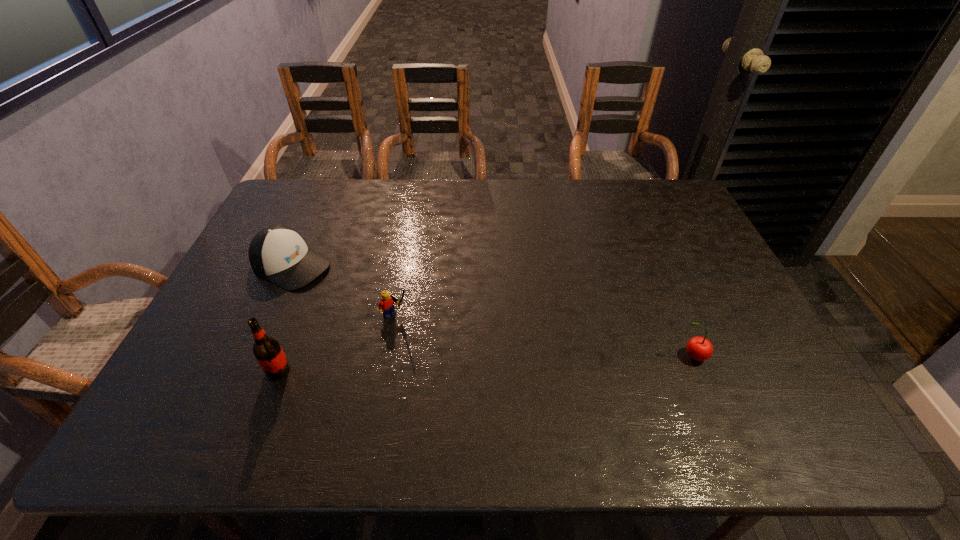
Where is `free space on the desktop that is between the root beer and the cherry and is positioned on the front panel of the farthest object`? Image resolution: width=960 pixels, height=540 pixels. free space on the desktop that is between the root beer and the cherry and is positioned on the front panel of the farthest object is located at coordinates (481, 364).

You are a GUI agent. You are given a task and a screenshot of the screen. Output one action in this format:
    pyautogui.click(x=<x>, y=<y>)
    Task: Click on the free spot on the desktop that is between the root beer and the rightmost object and is positioned on the front-facing side of the third object from left to right
    This screenshot has height=540, width=960.
    Given the screenshot: What is the action you would take?
    pyautogui.click(x=454, y=364)